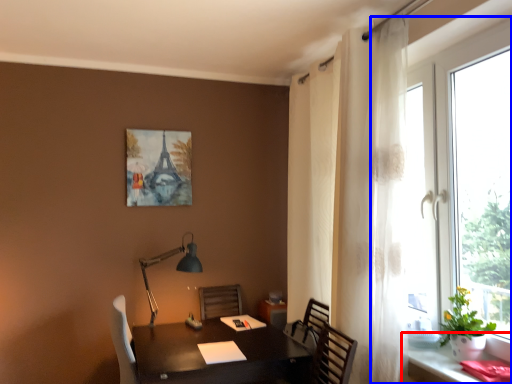
Question: Among these objects, which one is nearest to the camera, computer desk (highlighted by a red box) or window (highlighted by a blue box)?

Choices:
 (A) computer desk
 (B) window

Answer: (A)